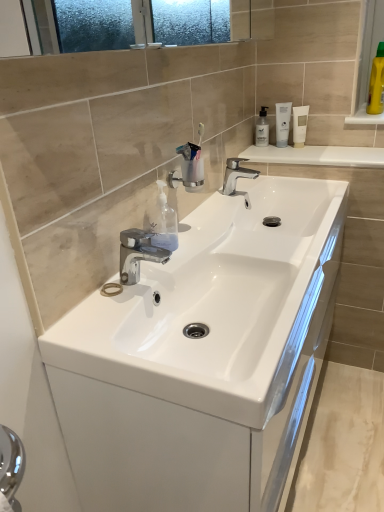
The height and width of the screenshot is (512, 384). I want to click on free area behind chrome metallic faucet at center, acting as the 1th tap starting from the left, so click(173, 261).